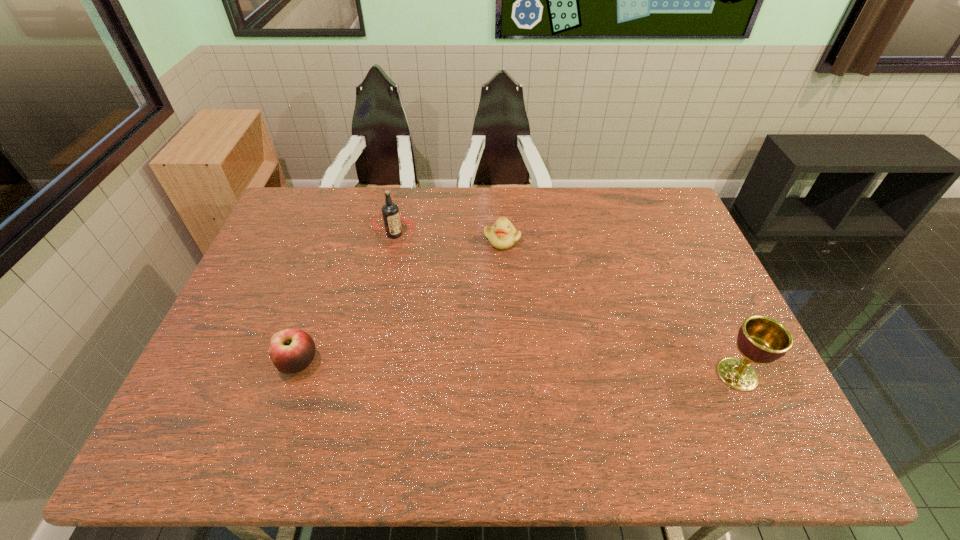
I want to click on apple, so click(292, 350).

Identify the location of the third tallest object. The image size is (960, 540). (292, 350).

At what (x,y) coordinates should I click in order to perform the action: click on the rightmost object. Please return your answer as a coordinate pair (x, y). Looking at the image, I should click on (761, 339).

The image size is (960, 540). In order to click on the third object from left to right in this screenshot , I will do `click(502, 235)`.

You are a GUI agent. You are given a task and a screenshot of the screen. Output one action in this format:
    pyautogui.click(x=<x>, y=<y>)
    Task: Click on the duckling
    This screenshot has width=960, height=540.
    Given the screenshot: What is the action you would take?
    pyautogui.click(x=502, y=235)

Where is `the third object from right to left`? The height and width of the screenshot is (540, 960). the third object from right to left is located at coordinates click(x=392, y=219).

The height and width of the screenshot is (540, 960). I want to click on vacant space located 0.260m on the right of the leftmost object, so click(x=423, y=363).

At what (x,y) coordinates should I click in order to perform the action: click on blank space located on the left of the rightmost object. Please return your answer as a coordinate pair (x, y). The image size is (960, 540). Looking at the image, I should click on (589, 374).

The width and height of the screenshot is (960, 540). In order to click on vacant space located on the beak of the shortest object in this screenshot , I will do `click(518, 273)`.

At what (x,y) coordinates should I click in order to perform the action: click on blank space located 0.230m on the beak of the shortest object. Please return your answer as a coordinate pair (x, y). Looking at the image, I should click on (534, 305).